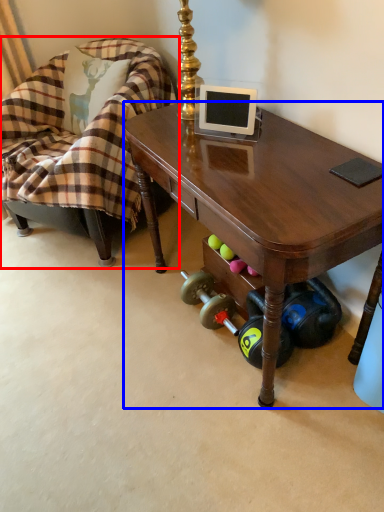
Question: Which of the following is the farthest to the observer, chair (highlighted by a red box) or desk (highlighted by a blue box)?

Choices:
 (A) chair
 (B) desk

Answer: (A)